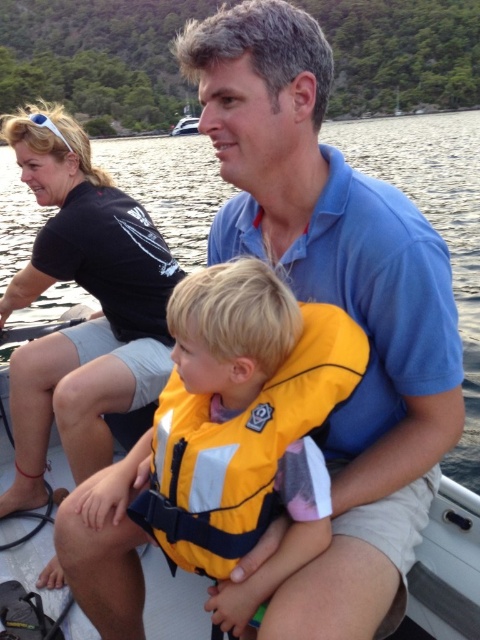
You are standing on the boat and want to reach both the point at coordinates point (x=91, y=364) and the point at coordinates point (x=242, y=524). Which point do you need to walk towards first to reach the closer one?

You should walk towards point (x=91, y=364) first because it is closer to you than point (x=242, y=524).

Consider the image. You are a photographer trying to capture a clear photo of both the black fabric shirt at upper left and the yellow fabric life jacket at center. Which object should you focus on first if you want to ensure both are in focus?

The black fabric shirt at upper left is bigger than the yellow fabric life jacket at center, so you should focus on the black fabric shirt at upper left first to ensure both are in focus.

In the scene on the boat, you need to determine if the black fabric shirt at upper left is covering any part of the yellow fabric life jacket at center. Based on the spatial arrangement, can you confirm this?

The black fabric shirt at upper left is positioned over the yellow fabric life jacket at center, so yes, it is covering part of it.